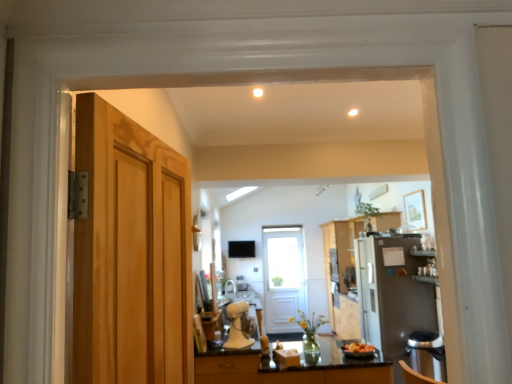
Question: Is multicolored plastic bowl at center completely or partially outside of wooden cabinet at center?

Choices:
 (A) no
 (B) yes

Answer: (B)

Question: Does multicolored plastic bowl at center have a lesser width compared to wooden cabinet at center?

Choices:
 (A) no
 (B) yes

Answer: (B)

Question: Is multicolored plastic bowl at center facing away from wooden cabinet at center?

Choices:
 (A) yes
 (B) no

Answer: (B)

Question: Is multicolored plastic bowl at center positioned behind wooden cabinet at center?

Choices:
 (A) no
 (B) yes

Answer: (A)

Question: Does multicolored plastic bowl at center appear on the right side of wooden cabinet at center?

Choices:
 (A) no
 (B) yes

Answer: (A)

Question: Is wooden cabinet at center wider or thinner than white wooden door at center, positioned as the first door in bottom-to-top order?

Choices:
 (A) wide
 (B) thin

Answer: (A)

Question: Considering their positions, is wooden cabinet at center located in front of or behind white wooden door at center, positioned as the first door in bottom-to-top order?

Choices:
 (A) front
 (B) behind

Answer: (A)

Question: From the image's perspective, is wooden cabinet at center positioned above or below white wooden door at center, which is counted as the 2th door, starting from the left?

Choices:
 (A) below
 (B) above

Answer: (B)

Question: Considering the positions of point (355, 316) and point (265, 228), is point (355, 316) closer or farther from the camera than point (265, 228)?

Choices:
 (A) closer
 (B) farther

Answer: (A)

Question: Is satin silver refrigerator at right, which is counted as the second appliance, starting from the left, to the left or to the right of multicolored plastic bowl at center in the image?

Choices:
 (A) right
 (B) left

Answer: (A)

Question: Is satin silver refrigerator at right, placed as the 2th appliance when sorted from front to back, inside the boundaries of multicolored plastic bowl at center, or outside?

Choices:
 (A) outside
 (B) inside

Answer: (A)

Question: In the image, is satin silver refrigerator at right, which is counted as the second appliance, starting from the left, positioned in front of or behind multicolored plastic bowl at center?

Choices:
 (A) behind
 (B) front

Answer: (A)

Question: Considering the positions of satin silver refrigerator at right, which is counted as the second appliance, starting from the left, and multicolored plastic bowl at center in the image, is satin silver refrigerator at right, which is counted as the second appliance, starting from the left, taller or shorter than multicolored plastic bowl at center?

Choices:
 (A) tall
 (B) short

Answer: (A)

Question: Is white wooden door at center, placed as the 2th door when sorted from front to back, inside the boundaries of wooden cabinet at center, or outside?

Choices:
 (A) outside
 (B) inside

Answer: (A)

Question: Is white wooden door at center, which is the 1th door in back-to-front order, taller or shorter than wooden cabinet at center?

Choices:
 (A) short
 (B) tall

Answer: (A)